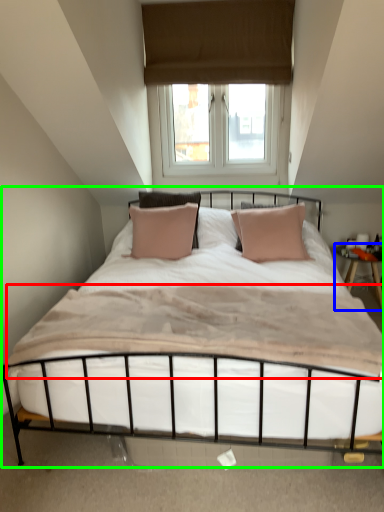
Question: Which object is the closest to the mattress (highlighted by a red box)? Choose among these: nightstand (highlighted by a blue box) or bed (highlighted by a green box).

Choices:
 (A) nightstand
 (B) bed

Answer: (B)